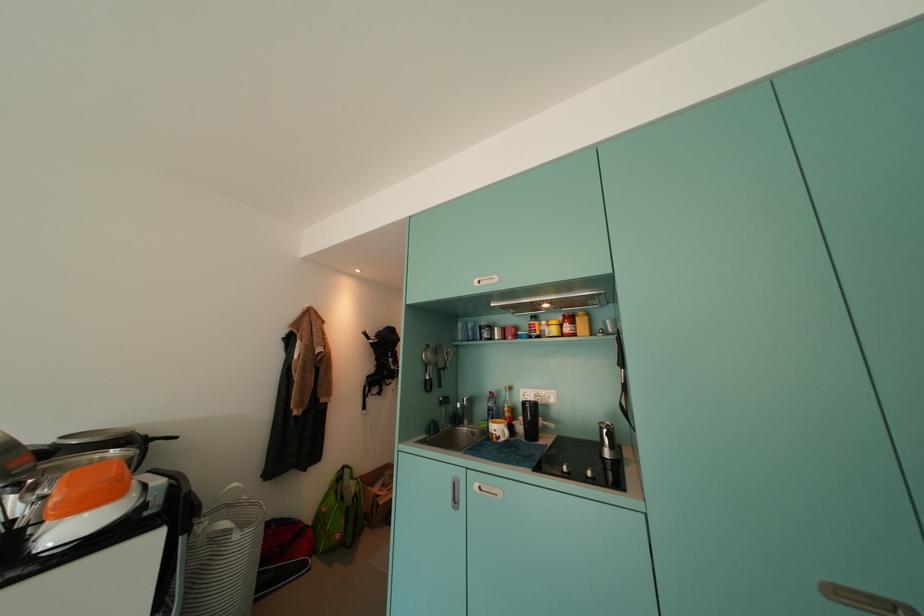
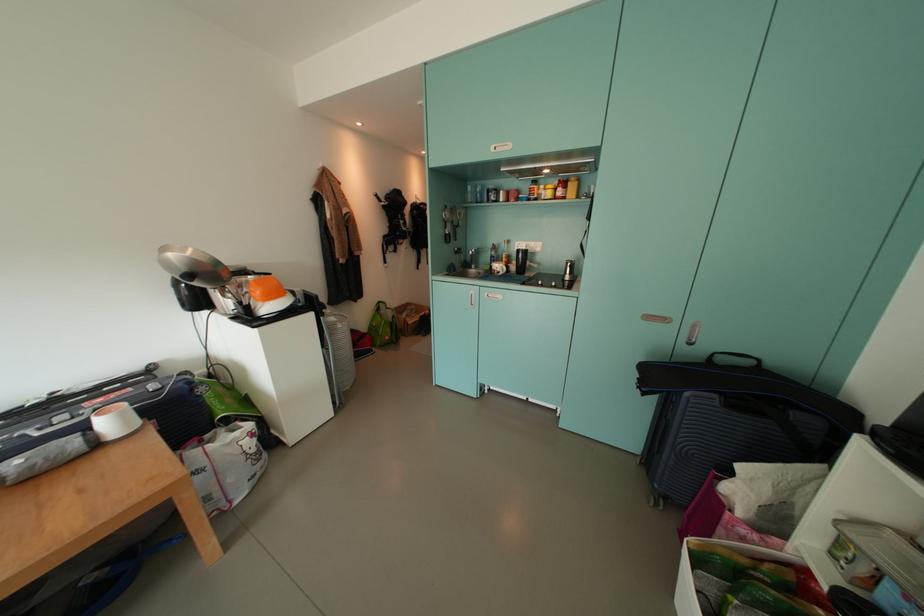
Locate, in the second image, the point that corresponds to the point at 575,331 in the first image.

(566, 195)